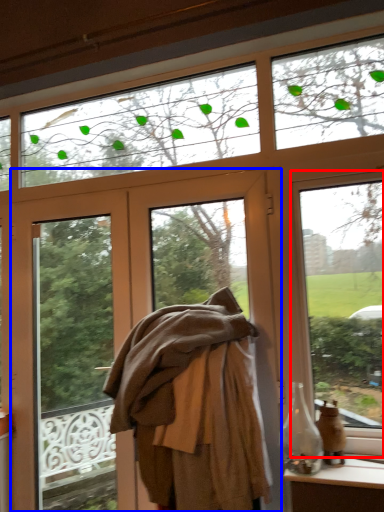
Question: Which object is further to the camera taking this photo, window (highlighted by a red box) or door (highlighted by a blue box)?

Choices:
 (A) window
 (B) door

Answer: (B)